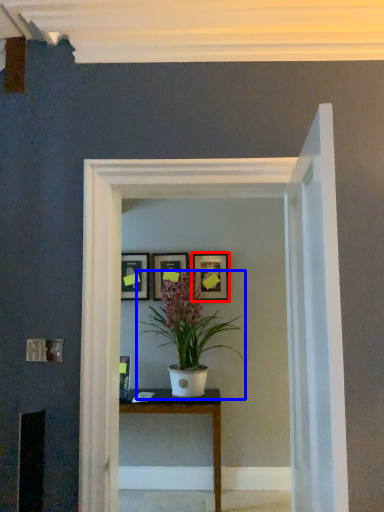
Question: Which object appears closest to the camera in this image, picture frame (highlighted by a red box) or houseplant (highlighted by a blue box)?

Choices:
 (A) picture frame
 (B) houseplant

Answer: (B)